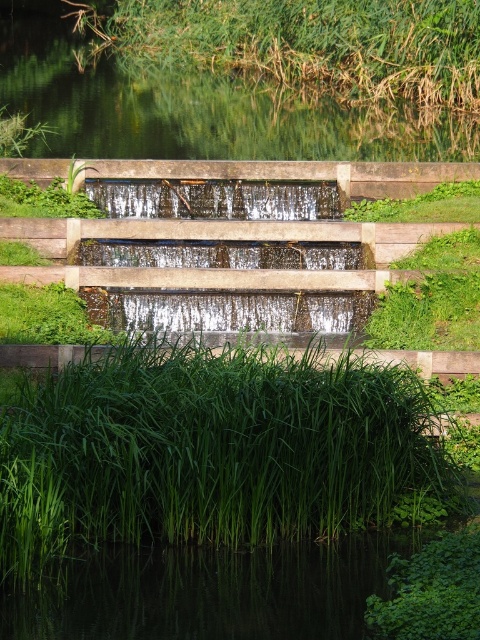
Is point (153, 417) in front of point (282, 60)?

Yes, it is.

Find the location of a particular element. green leafy grass at lower center is located at coordinates (213, 449).

Is point (324, 525) positioned behind point (179, 3)?

No, it is in front of (179, 3).

Identify the location of green leafy grass at lower center. The width and height of the screenshot is (480, 640). pyautogui.click(x=213, y=449).